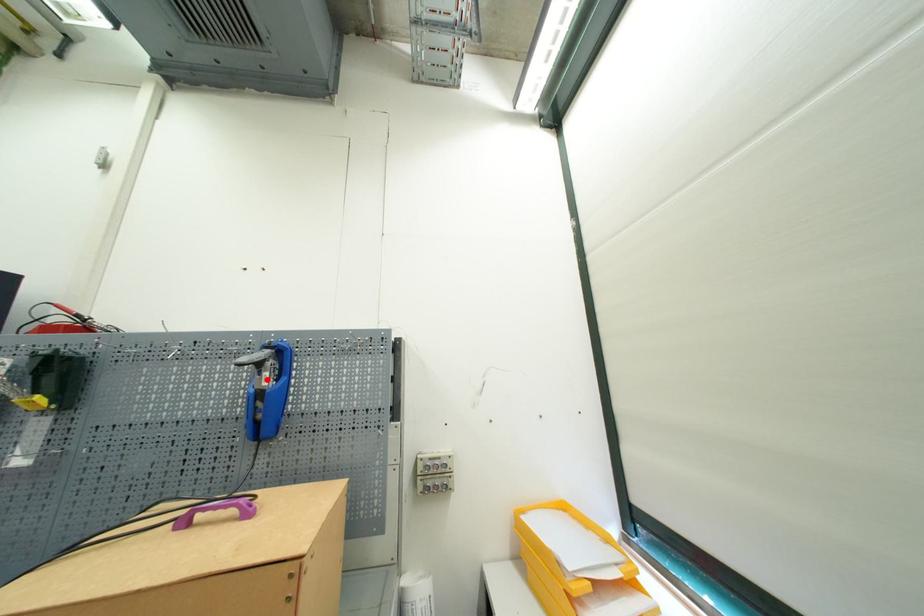
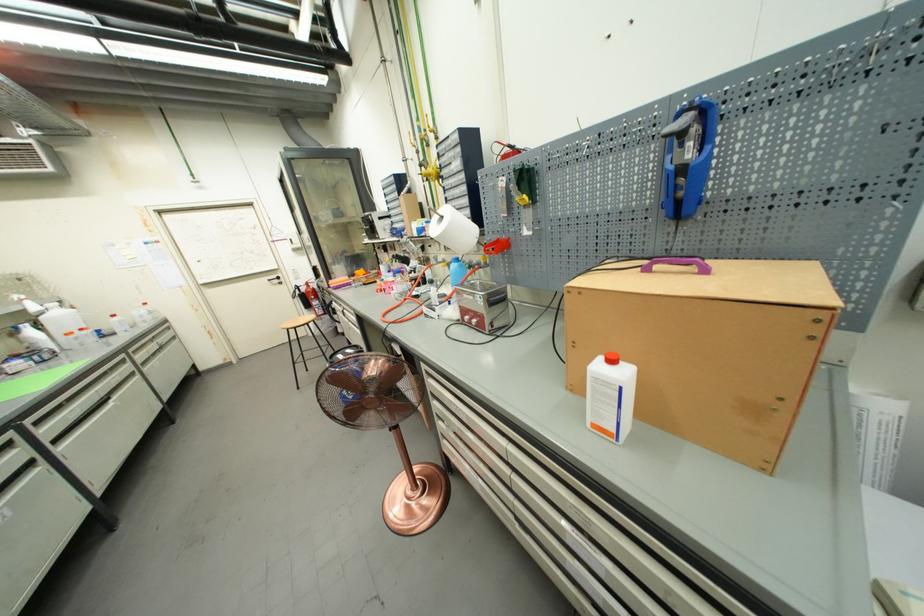
The point at the highlighted location is marked in the first image. Where is the corresponding point in the second image?

(689, 152)